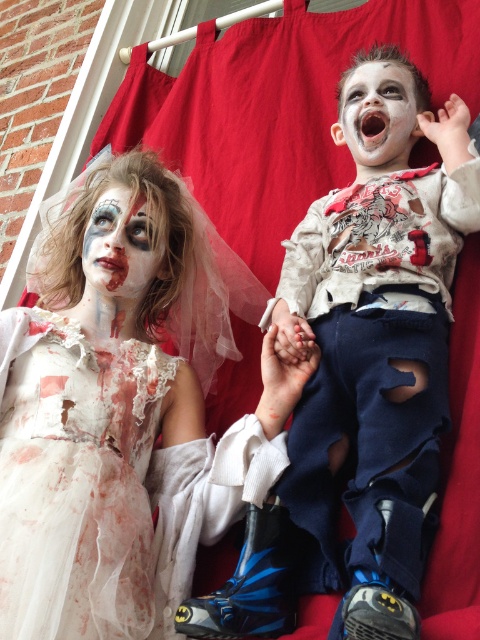
Who is higher up, distressed white shirt at upper right or matte white face at center?

matte white face at center is above.

Who is taller, distressed white shirt at upper right or matte white face at center?

With more height is distressed white shirt at upper right.

Which is behind, point (348, 202) or point (130, 208)?

Positioned behind is point (130, 208).

Locate an element on the screen. distressed white shirt at upper right is located at coordinates (360, 394).

Between white matte face at upper right and matte white face at center, which one is positioned lower?

matte white face at center is below.

Does white matte face at upper right appear on the right side of matte white face at center?

Indeed, white matte face at upper right is positioned on the right side of matte white face at center.

Is point (361, 156) farther from viewer compared to point (96, 268)?

Yes, point (361, 156) is farther from viewer.

I want to click on white matte face at upper right, so click(377, 116).

Looking at this image, who is positioned more to the right, white lace dress at left or white matte face at upper right?

white matte face at upper right

Who is more distant from viewer, [58,637] or [365,138]?

The point [365,138] is behind.

Find the location of a particular element. white lace dress at left is located at coordinates (75, 481).